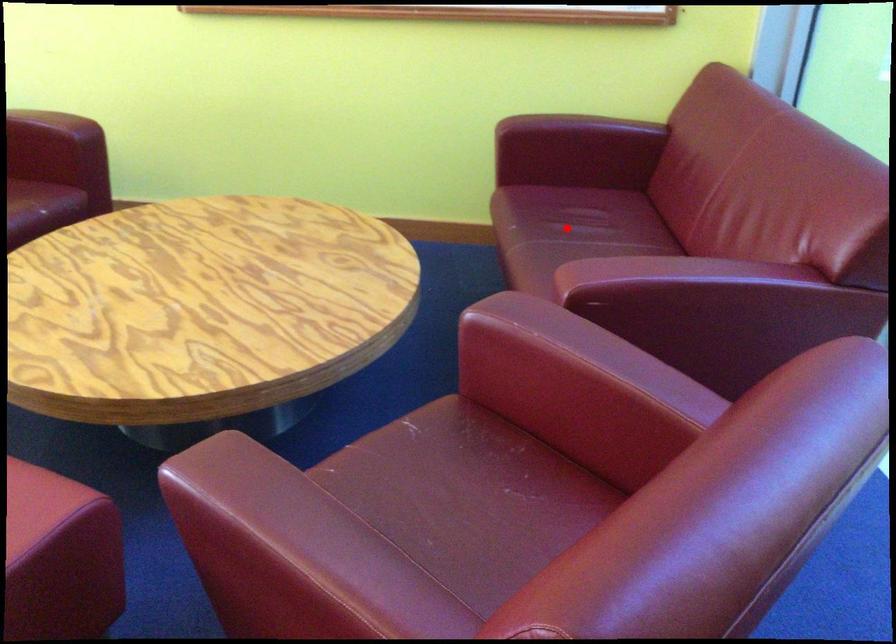
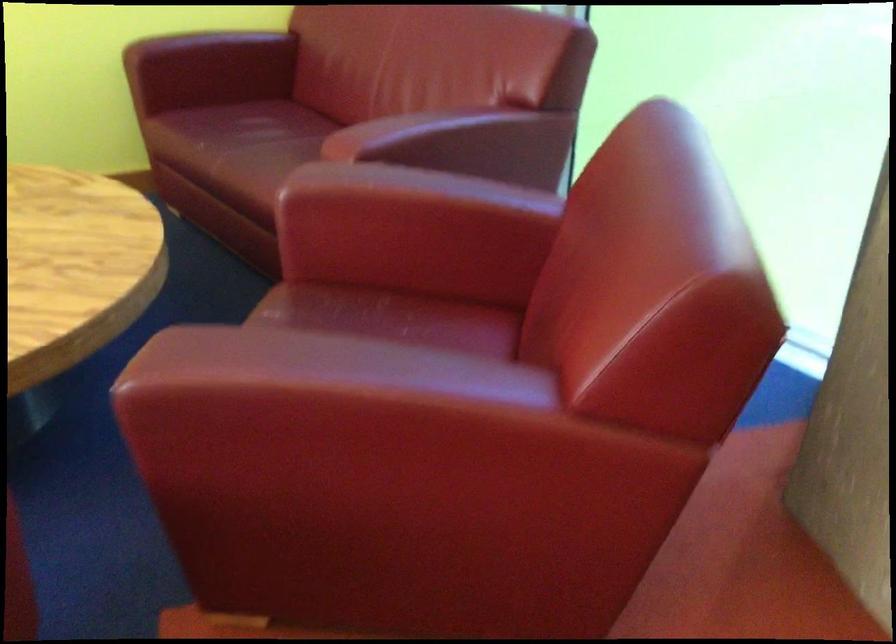
Find the pixel in the second image that matches the highlighted location in the first image.

(263, 131)